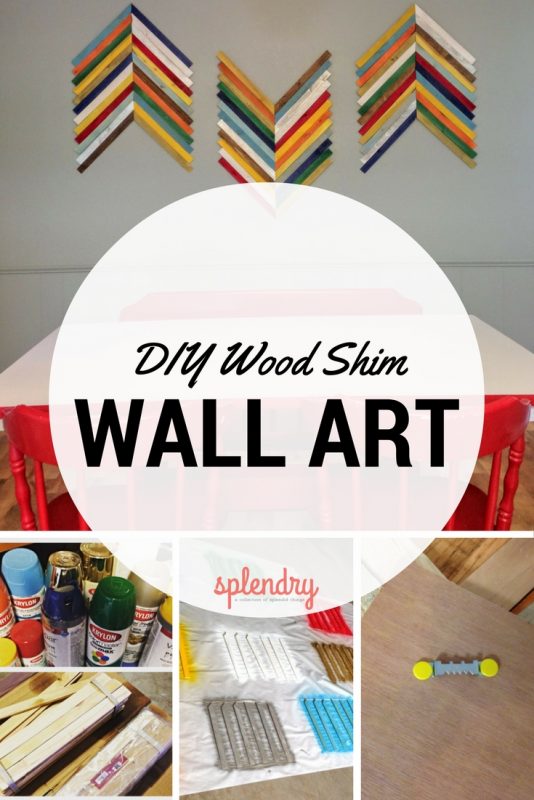
Locate an element on the screen. The width and height of the screenshot is (534, 800). floor is located at coordinates (466, 754).